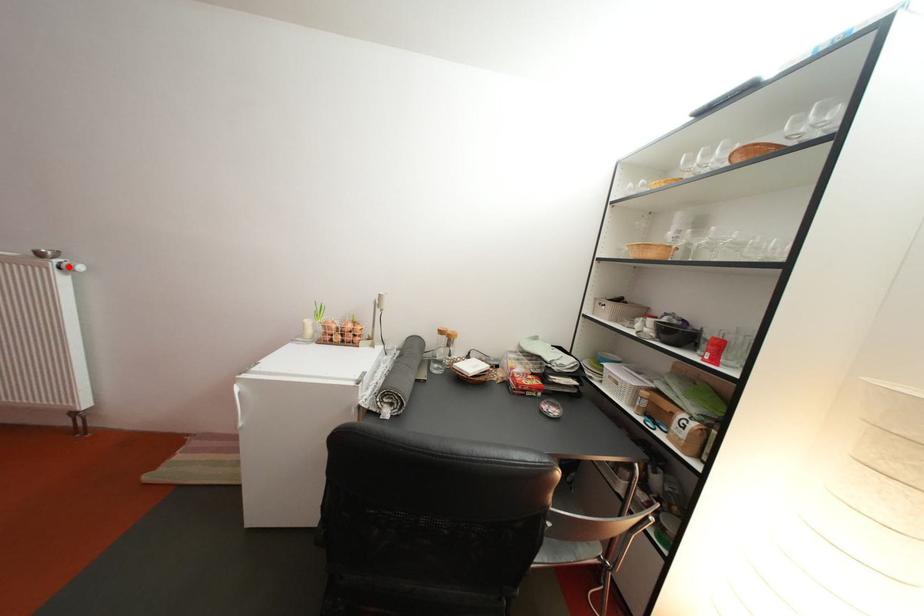
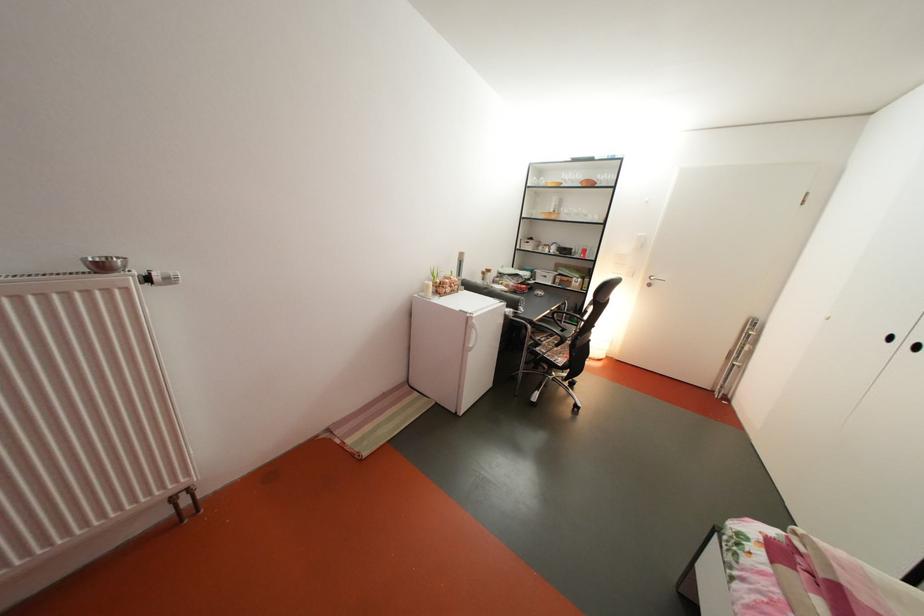
Question: I am providing you with two images of the same scene from different viewpoints. A red point is marked on the first image. Can you still see the location of the red point in image 2?

Choices:
 (A) Yes
 (B) No

Answer: (B)